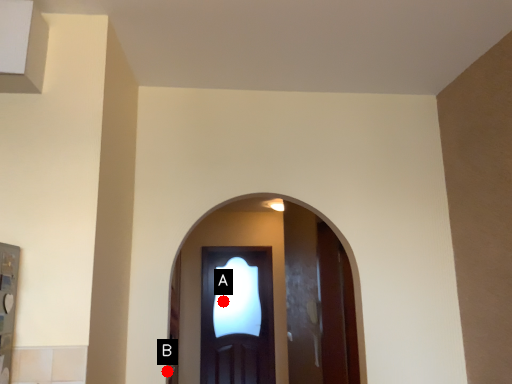
Question: Two points are circled on the image, labeled by A and B beside each circle. Which point is closer to the camera?

Choices:
 (A) A is closer
 (B) B is closer

Answer: (B)